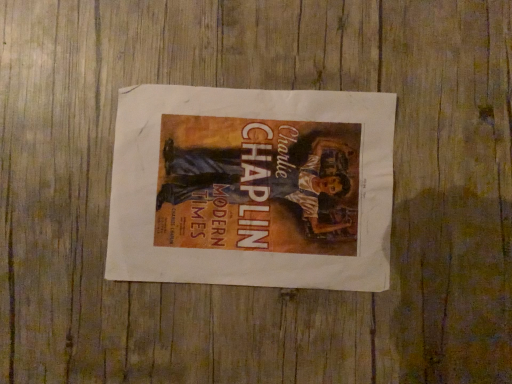
Describe the element at coordinates (252, 187) in the screenshot. I see `white paper poster at center` at that location.

Find the location of `white paper poster at center`. white paper poster at center is located at coordinates (252, 187).

You are a GUI agent. You are given a task and a screenshot of the screen. Output one action in this format:
    pyautogui.click(x=<x>, y=<y>)
    Task: Click on the white paper poster at center
    
    Given the screenshot: What is the action you would take?
    pyautogui.click(x=252, y=187)